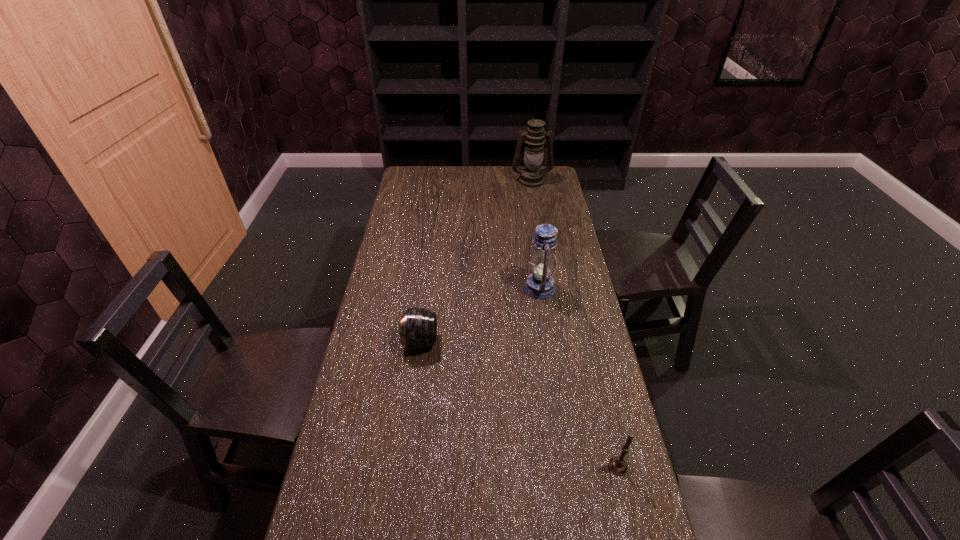
Find the location of a particular element. free space at the right edge is located at coordinates (595, 467).

Where is `vacant area at the far right corner of the desktop`? vacant area at the far right corner of the desktop is located at coordinates (559, 176).

Where is `vacant space that is in between the third farthest object and the candle`? This screenshot has width=960, height=540. vacant space that is in between the third farthest object and the candle is located at coordinates (519, 404).

Find the location of `free area in between the shortest object and the lantern`. free area in between the shortest object and the lantern is located at coordinates (480, 315).

The width and height of the screenshot is (960, 540). Identify the location of vacant point located between the oil lamp and the nearest object. (575, 323).

At what (x,y) coordinates should I click in order to perform the action: click on free space between the candle and the lantern. Please return your answer as a coordinate pair (x, y). Looking at the image, I should click on (579, 377).

Identify the location of vacant area that lies between the lantern and the shortest object. Image resolution: width=960 pixels, height=540 pixels. (480, 315).

Find the location of a particular element. This screenshot has width=960, height=540. free point between the third farthest object and the oil lamp is located at coordinates (476, 261).

The height and width of the screenshot is (540, 960). Identify the location of free space between the telephoto lens and the third nearest object. (480, 315).

Locate an element on the screen. This screenshot has height=540, width=960. object that is the third closest to the candle is located at coordinates (531, 176).